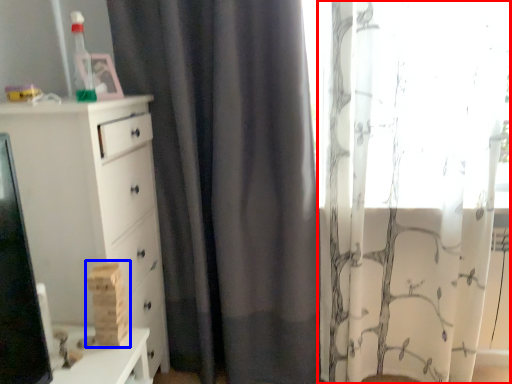
Question: Among these objects, which one is nearest to the camera, curtain (highlighted by a red box) or toy (highlighted by a blue box)?

Choices:
 (A) curtain
 (B) toy

Answer: (B)